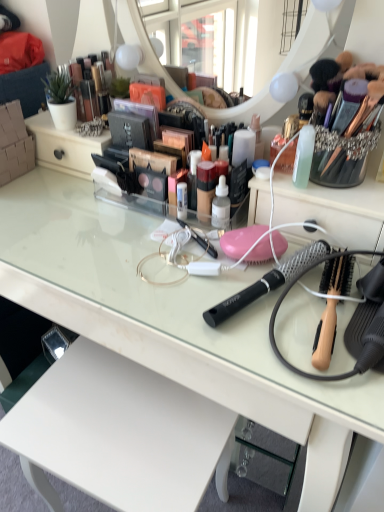
The width and height of the screenshot is (384, 512). I want to click on vacant location behind black mesh hairbrush at center, which appears as the second brush when viewed from the right, so click(212, 232).